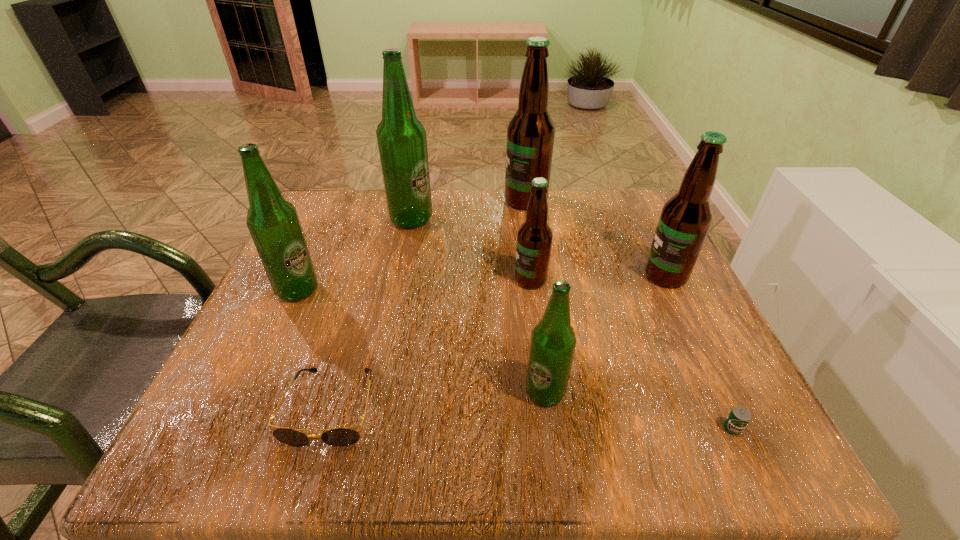
I want to click on vacant space that's between the beer can and the second green beer bottle from left to right, so click(572, 324).

The width and height of the screenshot is (960, 540). Find the location of `free space between the fifth beer bottle from right to left and the nearest beer bottle`. free space between the fifth beer bottle from right to left and the nearest beer bottle is located at coordinates (478, 306).

Image resolution: width=960 pixels, height=540 pixels. I want to click on vacant point located between the smallest brown beer bottle and the black sunglasses, so click(431, 343).

This screenshot has width=960, height=540. I want to click on empty space that is in between the black sunglasses and the beer can, so (x=532, y=417).

The image size is (960, 540). I want to click on free space between the beer can and the nearest green beer bottle, so click(638, 410).

Identify the location of vacant space that's between the farthest brown beer bottle and the rightmost brown beer bottle. This screenshot has height=540, width=960. (595, 238).

At what (x,y) coordinates should I click in order to perform the action: click on free space between the black sunglasses and the smallest brown beer bottle. Please return your answer as a coordinate pair (x, y). Looking at the image, I should click on (431, 343).

Find the location of a particular element. vacant region between the beer can and the biggest brown beer bottle is located at coordinates (629, 314).

Where is `free area in between the leftmost green beer bottle and the sunglasses`? The height and width of the screenshot is (540, 960). free area in between the leftmost green beer bottle and the sunglasses is located at coordinates (315, 349).

I want to click on object that ranks as the fifth closest to the black sunglasses, so click(739, 417).